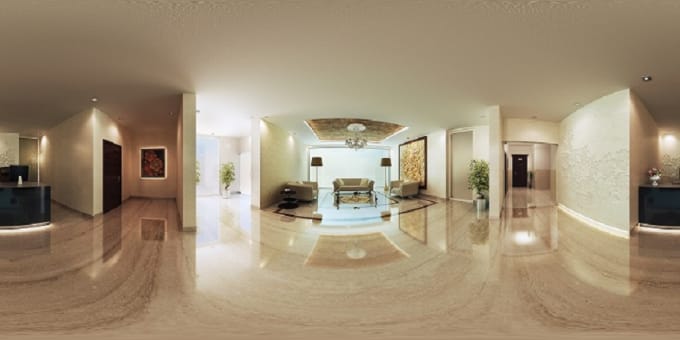
Find the location of `hallway on right side`. hallway on right side is located at coordinates (523, 168).